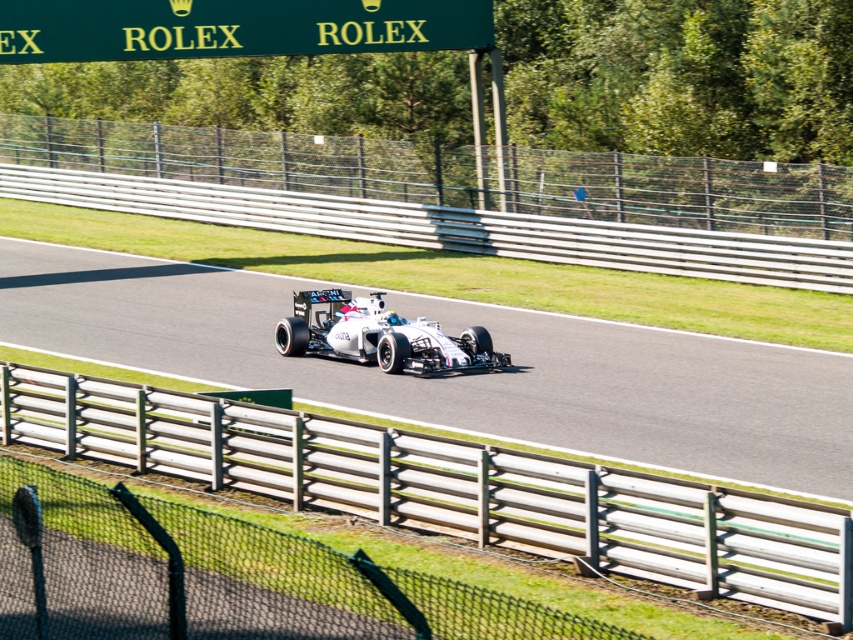
You are a Formula One race engineer analyzing the track layout. The race track must be positioned precisely at the center of the coordinate system for optimal simulation. Is the white asphalt race track at center correctly placed for the simulation?

The white asphalt race track at center is located at coordinates point [461,374], which is close to the center but not exactly at the center point [426,320]. Therefore, it may not be perfectly centered for the simulation.

Looking at this image, you are a race car driver preparing for a turn. You notice the white asphalt race track at center and the green sign at upper center. Which object is nearer to your position in the car?

The white asphalt race track at center is closer to the viewer than the green sign at upper center, so the white asphalt race track at center is nearer to your position in the car.